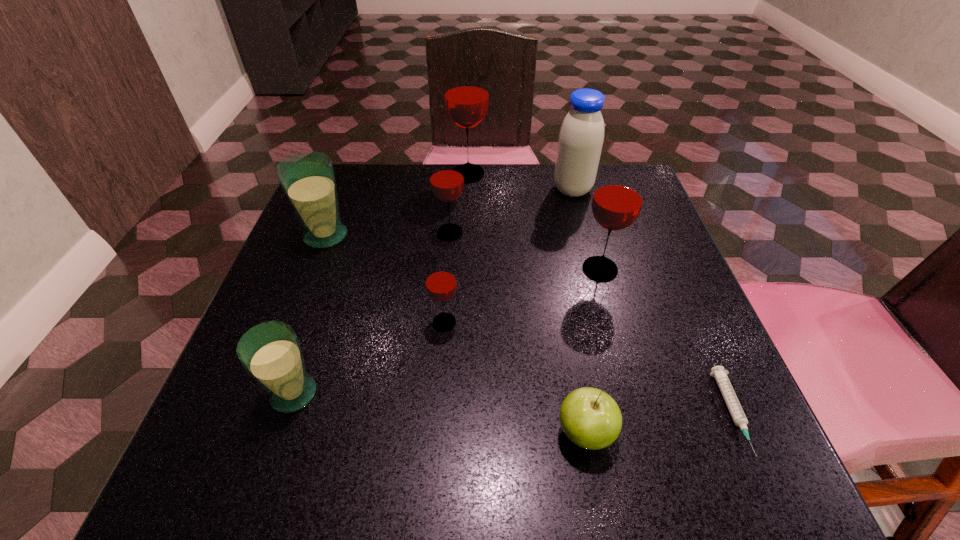
Find the location of a particular element. The width and height of the screenshot is (960, 540). the sixth farthest object is located at coordinates (440, 281).

The height and width of the screenshot is (540, 960). I want to click on green apple, so click(590, 418).

This screenshot has width=960, height=540. I want to click on the eighth tallest object, so click(x=590, y=418).

In order to click on syringe in this screenshot , I will do `click(732, 402)`.

Where is `the rightmost object`? Image resolution: width=960 pixels, height=540 pixels. the rightmost object is located at coordinates (732, 402).

The image size is (960, 540). Find the location of `free region located 0.170m on the left of the tallest glass`. free region located 0.170m on the left of the tallest glass is located at coordinates (383, 174).

This screenshot has height=540, width=960. I want to click on free space located 0.210m on the front of the blue soya milk, so click(x=591, y=260).

You are a GUI agent. You are given a task and a screenshot of the screen. Output one action in this format:
    pyautogui.click(x=<x>, y=<y>)
    Task: Click on the vacant space located on the back of the second biggest red glass
    The image size is (960, 540).
    Given the screenshot: What is the action you would take?
    pyautogui.click(x=590, y=233)

I want to click on vacant region located on the back of the second farthest red glass, so click(454, 180).

In order to click on free point located on the right of the farther blue glass in this screenshot , I will do 391,236.